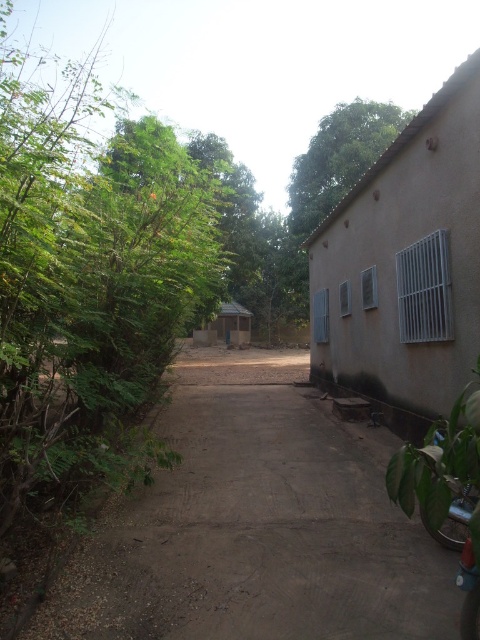
Can you confirm if dirt path at center is positioned above green leafy bush at left?

No.

You are a GUI agent. You are given a task and a screenshot of the screen. Output one action in this format:
    pyautogui.click(x=<x>, y=<y>)
    Task: Click on the dirt path at center
    
    Given the screenshot: What is the action you would take?
    pyautogui.click(x=256, y=525)

Does point (431, 547) lie behind point (108, 381)?

No.

I want to click on dirt path at center, so coord(256,525).

Is dirt path at center to the left of green leafy tree at upper center from the viewer's perspective?

Yes, dirt path at center is to the left of green leafy tree at upper center.

Between dirt path at center and green leafy tree at upper center, which one appears on the left side from the viewer's perspective?

dirt path at center

Does point (231, 492) come behind point (289, 195)?

No, (231, 492) is in front of (289, 195).

Find the location of a particular element. The height and width of the screenshot is (640, 480). dirt path at center is located at coordinates (256, 525).

Consider the image. Who is positioned more to the left, green leafy bush at left or green leafy tree at upper center?

green leafy bush at left is more to the left.

The image size is (480, 640). Identify the location of green leafy bush at left. (87, 272).